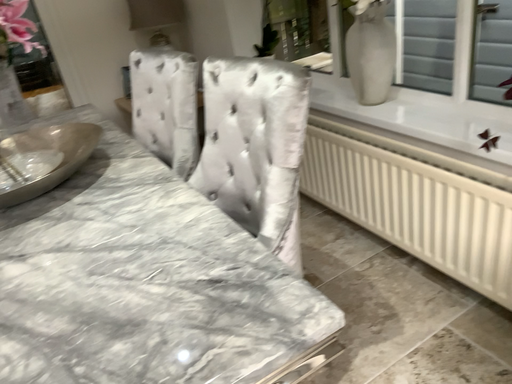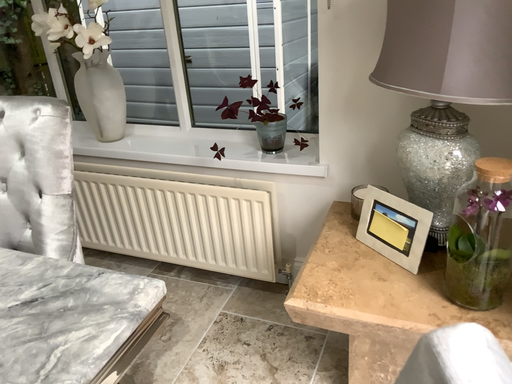
Question: How did the camera likely rotate when shooting the video?

Choices:
 (A) rotated downward
 (B) rotated upward

Answer: (B)